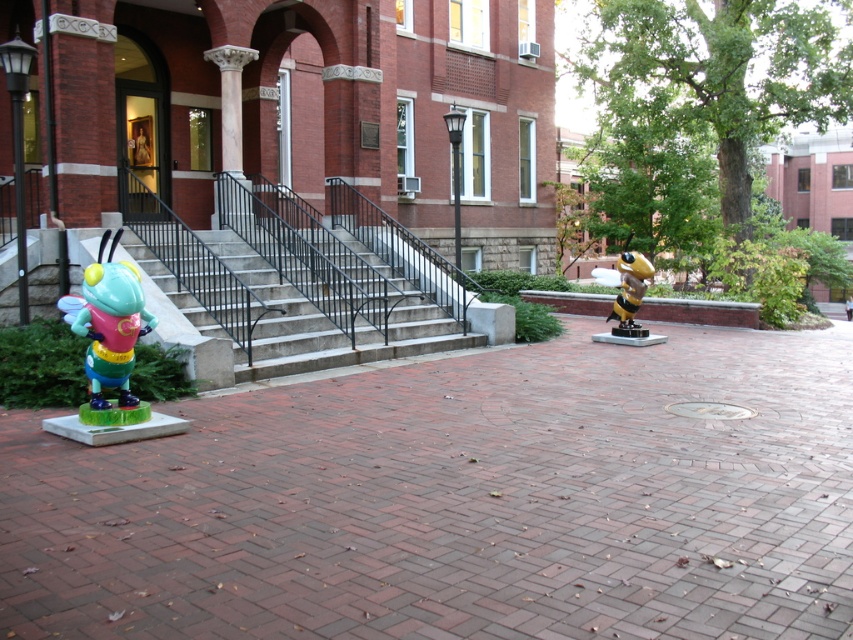
Who is higher up, brick pavement at center or concrete stairs at center?

concrete stairs at center is above.

How distant is brick pavement at center from concrete stairs at center?

brick pavement at center is 9.74 feet from concrete stairs at center.

Which is behind, point (64, 493) or point (234, 236)?

The point (234, 236) is behind.

Locate an element on the screen. brick pavement at center is located at coordinates (457, 500).

Looking at this image, does brick pavement at center have a greater width compared to yellow and black plastic bee at center right?

Correct, the width of brick pavement at center exceeds that of yellow and black plastic bee at center right.

Who is more forward, [190,550] or [605,272]?

Point [190,550] is more forward.

Identify the location of brick pavement at center. Image resolution: width=853 pixels, height=640 pixels. (457, 500).

From the picture: Is brick pavement at center taller than matte plastic bee at left?

Yes, brick pavement at center is taller than matte plastic bee at left.

Is point (660, 611) closer to camera compared to point (94, 317)?

Yes, point (660, 611) is closer to viewer.

Who is more distant from viewer, (453,384) or (119,346)?

The point (453,384) is more distant.

Where is `brick pavement at center`? brick pavement at center is located at coordinates (457, 500).